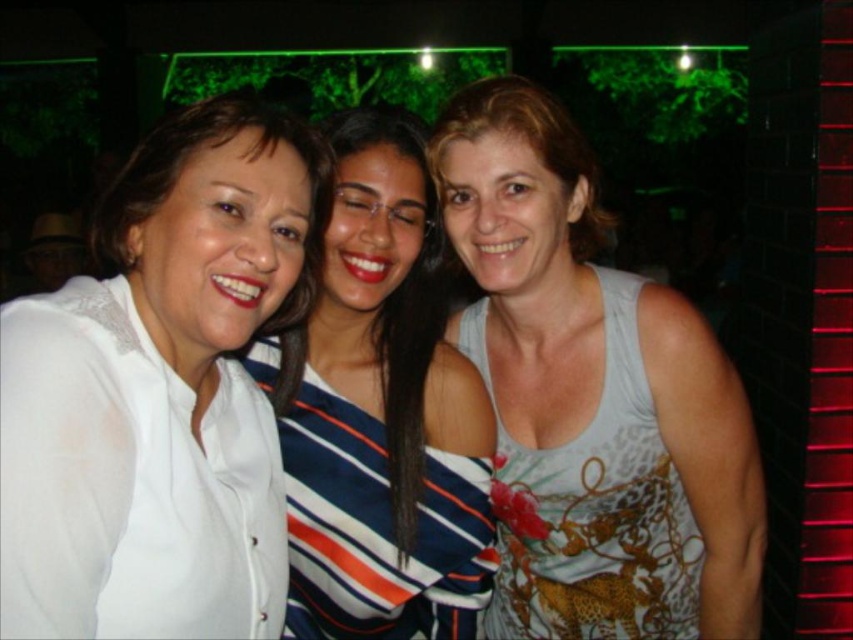
Question: Considering the real-world distances, which object is closest to the white sheer blouse at left?

Choices:
 (A) white printed tank top at right
 (B) white matte shirt at center
 (C) printed fabric tank top at center

Answer: (B)

Question: Is white matte shirt at center thinner than printed fabric tank top at center?

Choices:
 (A) no
 (B) yes

Answer: (B)

Question: Estimate the real-world distances between objects in this image. Which object is closer to the white printed tank top at right?

Choices:
 (A) printed fabric tank top at center
 (B) white sheer blouse at left

Answer: (A)

Question: Is white matte shirt at center closer to the viewer compared to printed fabric tank top at center?

Choices:
 (A) yes
 (B) no

Answer: (A)

Question: Among these points, which one is farthest from the camera?

Choices:
 (A) (564, 490)
 (B) (538, 550)
 (C) (296, 595)

Answer: (B)

Question: From the image, what is the correct spatial relationship of white sheer blouse at left in relation to white matte shirt at center?

Choices:
 (A) left
 (B) right

Answer: (A)